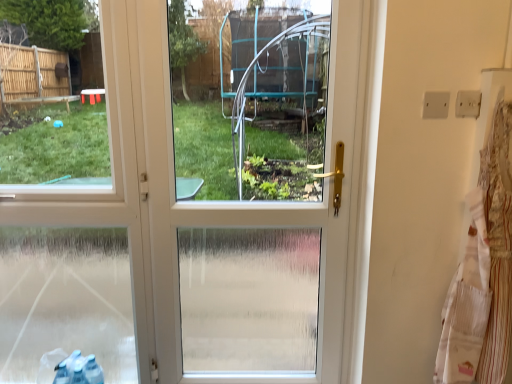
Question: Based on their sizes in the image, would you say white plastic screen door at center is bigger or smaller than white striped laundry at right?

Choices:
 (A) big
 (B) small

Answer: (A)

Question: Visually, is white plastic screen door at center positioned to the left or to the right of white striped laundry at right?

Choices:
 (A) right
 (B) left

Answer: (B)

Question: Is white plastic screen door at center spatially inside white striped laundry at right, or outside of it?

Choices:
 (A) outside
 (B) inside

Answer: (A)

Question: Does point (497, 145) appear closer or farther from the camera than point (181, 274)?

Choices:
 (A) closer
 (B) farther

Answer: (A)

Question: Considering the positions of white striped laundry at right and white plastic screen door at center in the image, is white striped laundry at right taller or shorter than white plastic screen door at center?

Choices:
 (A) tall
 (B) short

Answer: (B)

Question: Is white striped laundry at right to the left or to the right of white plastic screen door at center in the image?

Choices:
 (A) right
 (B) left

Answer: (A)

Question: Considering the positions of white striped laundry at right and white plastic screen door at center in the image, is white striped laundry at right wider or thinner than white plastic screen door at center?

Choices:
 (A) wide
 (B) thin

Answer: (B)